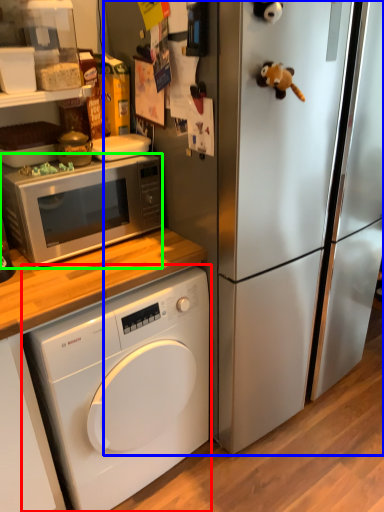
Question: Considering the real-world distances, which object is closest to washing machine (highlighted by a red box)? refrigerator (highlighted by a blue box) or microwave oven (highlighted by a green box).

Choices:
 (A) refrigerator
 (B) microwave oven

Answer: (A)